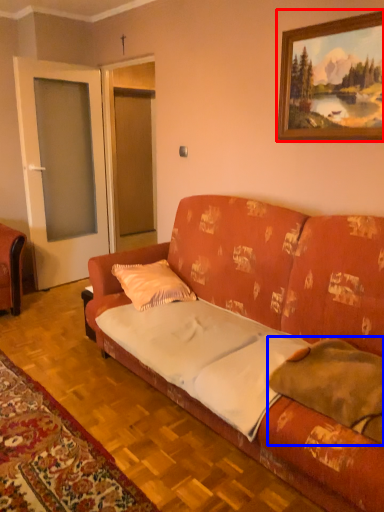
Question: Which object appears closest to the camera in this image, picture frame (highlighted by a red box) or pillow (highlighted by a blue box)?

Choices:
 (A) picture frame
 (B) pillow

Answer: (B)